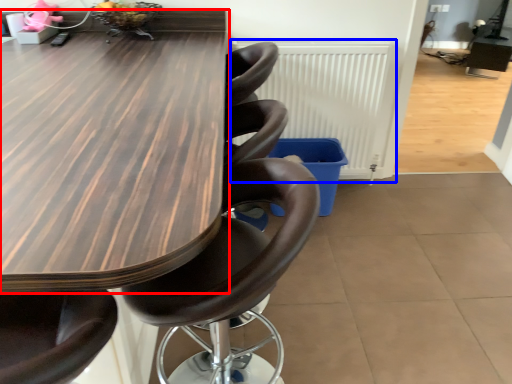
Question: Which point is further to the camera, table (highlighted by a red box) or radiator (highlighted by a blue box)?

Choices:
 (A) table
 (B) radiator

Answer: (B)